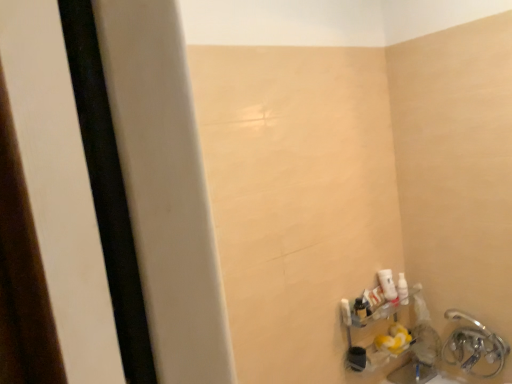
Question: From the image's perspective, does white glossy lotion at lower right appear higher than silver metallic faucet at lower right?

Choices:
 (A) no
 (B) yes

Answer: (B)

Question: Is silver metallic faucet at lower right at the back of white glossy lotion at lower right?

Choices:
 (A) no
 (B) yes

Answer: (A)

Question: Is white glossy lotion at lower right positioned beyond the bounds of silver metallic faucet at lower right?

Choices:
 (A) no
 (B) yes

Answer: (B)

Question: Are white glossy lotion at lower right and silver metallic faucet at lower right making contact?

Choices:
 (A) no
 (B) yes

Answer: (A)

Question: Is white glossy lotion at lower right wider than silver metallic faucet at lower right?

Choices:
 (A) no
 (B) yes

Answer: (A)

Question: Is white glossy lotion at lower right far from silver metallic faucet at lower right?

Choices:
 (A) yes
 (B) no

Answer: (B)

Question: Is the position of silver metallic faucet at lower right more distant than that of white glossy lotion at lower right?

Choices:
 (A) no
 (B) yes

Answer: (A)

Question: Can you confirm if silver metallic faucet at lower right is bigger than white glossy lotion at lower right?

Choices:
 (A) no
 (B) yes

Answer: (B)

Question: From a real-world perspective, does silver metallic faucet at lower right sit lower than white glossy lotion at lower right?

Choices:
 (A) no
 (B) yes

Answer: (B)

Question: Is silver metallic faucet at lower right not close to white glossy lotion at lower right?

Choices:
 (A) yes
 (B) no

Answer: (B)

Question: Is silver metallic faucet at lower right positioned with its back to white glossy lotion at lower right?

Choices:
 (A) no
 (B) yes

Answer: (A)

Question: Is silver metallic faucet at lower right positioned before white glossy lotion at lower right?

Choices:
 (A) yes
 (B) no

Answer: (A)

Question: In the image, is white glossy lotion at lower right on the left side or the right side of silver metallic faucet at lower right?

Choices:
 (A) right
 (B) left

Answer: (B)